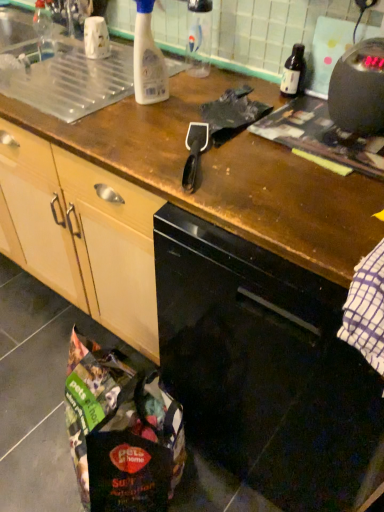
What are the coordinates of `vacant space situated on the left part of transparent plastic bottle at upper center, which appears as the second bottle when viewed from the right` in the screenshot? It's located at [x=165, y=72].